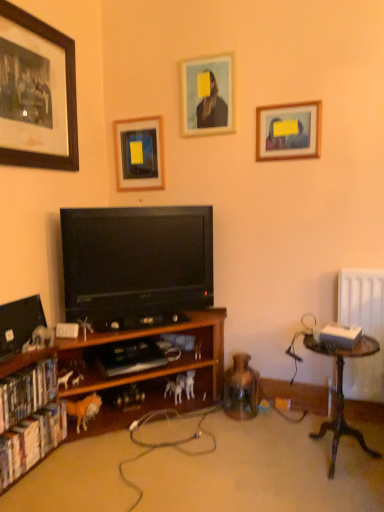
The width and height of the screenshot is (384, 512). In order to click on vacant space to the right of hardcover book at lower left, placed as the second book when sorted from top to bottom in this screenshot , I will do `click(74, 471)`.